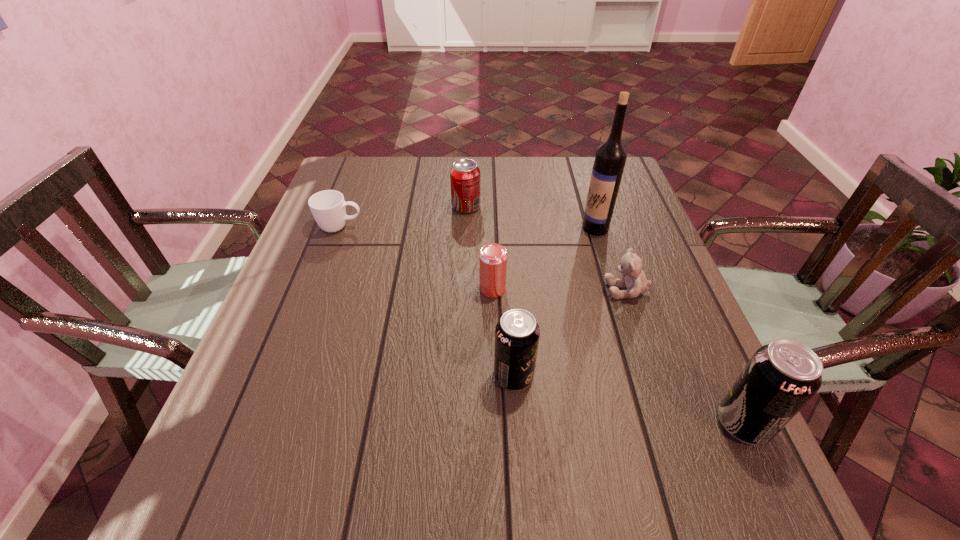
Where is `vacant space located on the right of the beer can`? The width and height of the screenshot is (960, 540). vacant space located on the right of the beer can is located at coordinates (609, 288).

I want to click on object present at the near edge, so click(x=780, y=378).

Identify the location of object that is at the left edge. This screenshot has width=960, height=540. (x=328, y=207).

Locate an element on the screen. The image size is (960, 540). soda can that is positioned at the right edge is located at coordinates (780, 378).

I want to click on wine bottle that is at the right edge, so click(x=611, y=155).

The image size is (960, 540). What are the coordinates of `teddy bear located at the right edge` in the screenshot? It's located at (630, 266).

The width and height of the screenshot is (960, 540). Identify the location of object present at the near right corner. (780, 378).

At what (x,y) coordinates should I click in order to perform the action: click on free region at the far edge. Please return your answer as a coordinate pair (x, y). Looking at the image, I should click on (510, 181).

Where is `free region at the near edge`? The height and width of the screenshot is (540, 960). free region at the near edge is located at coordinates (547, 418).

Where is `blank space at the left edge`? blank space at the left edge is located at coordinates (311, 227).